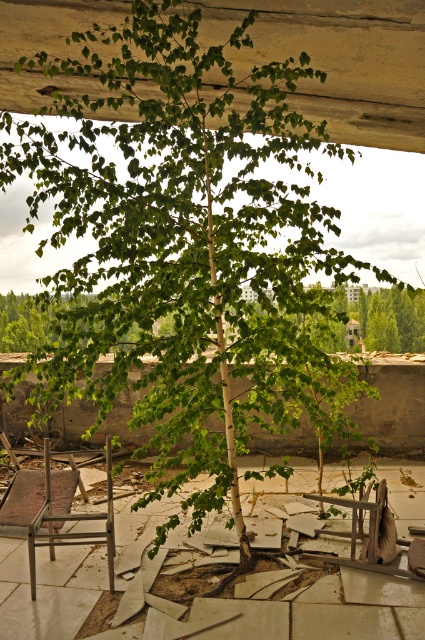
You are standing on the rooftop and want to plant a new flower bed near the green leafy tree at center. Based on the coordinates provided, where exactly should you position the flower bed relative to the tree?

The green leafy tree at center is located at coordinates point (388,317), so the flower bed should be positioned near those coordinates to be close to the tree.

You are a maintenance worker inspecting the rooftop. You notice the green leafy tree at center and the metallic silver chair at lower left. Which object is higher in elevation?

The green leafy tree at center is above the metallic silver chair at lower left, so it is higher in elevation.

You are a gardener assessing the rooftop garden. You notice the green leafy tree at center and the metallic silver chair at lower left. Which object takes up more space visually?

The metallic silver chair at lower left takes up more space visually than the green leafy tree at center since the tree is smaller in size compared to the chair.